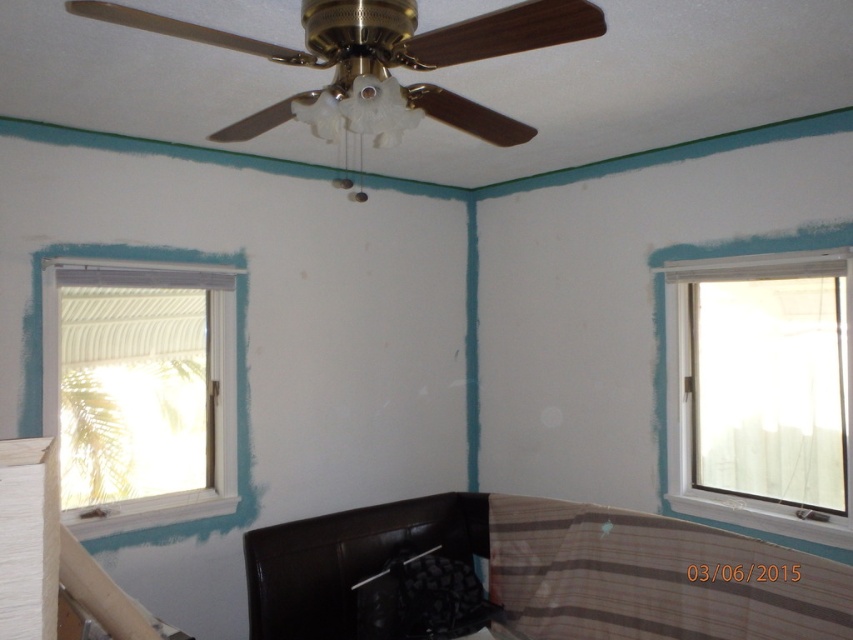
Question: Can you confirm if gold metallic ceiling fan at upper center is positioned above white plastic window at upper right?

Choices:
 (A) yes
 (B) no

Answer: (A)

Question: Which object is farther from the camera taking this photo?

Choices:
 (A) brown leather bed at lower center
 (B) white painted wood window at left
 (C) gold metallic ceiling fan at upper center
 (D) white plastic window at upper right

Answer: (B)

Question: Considering the real-world distances, which object is farthest from the gold metallic ceiling fan at upper center?

Choices:
 (A) white plastic window at upper right
 (B) white painted wood window at left
 (C) brown leather bed at lower center

Answer: (C)

Question: Estimate the real-world distances between objects in this image. Which object is farther from the white plastic window at upper right?

Choices:
 (A) white painted wood window at left
 (B) brown leather bed at lower center

Answer: (A)

Question: In this image, where is brown leather bed at lower center located relative to white plastic window at upper right?

Choices:
 (A) right
 (B) left

Answer: (B)

Question: Does gold metallic ceiling fan at upper center appear on the left side of white painted wood window at left?

Choices:
 (A) yes
 (B) no

Answer: (B)